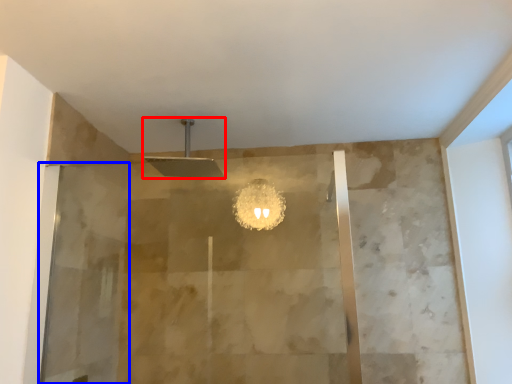
Question: Among these objects, which one is nearest to the camera, shower (highlighted by a red box) or screen door (highlighted by a blue box)?

Choices:
 (A) shower
 (B) screen door

Answer: (B)